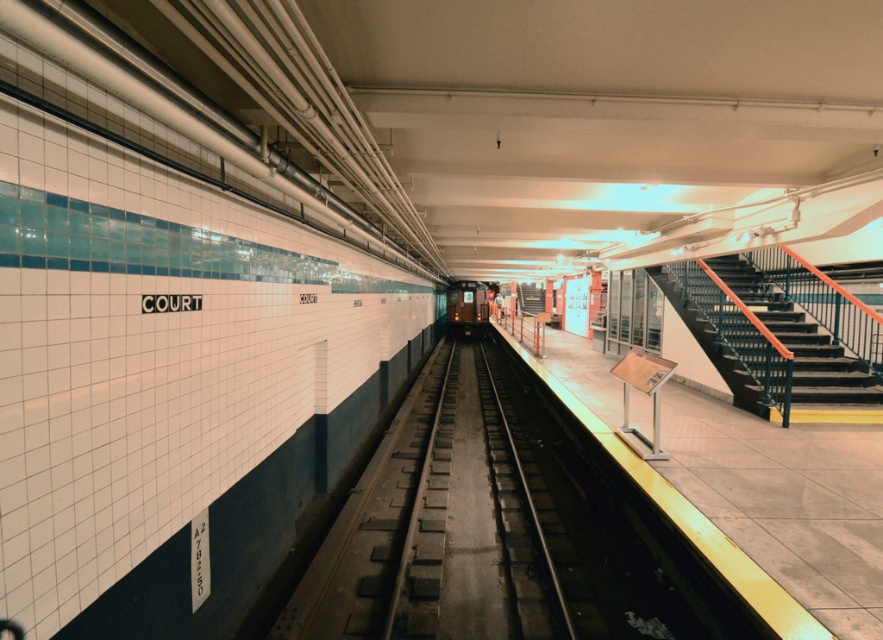
Question: Which point is closer to the camera taking this photo?

Choices:
 (A) (481, 298)
 (B) (737, 294)
 (C) (459, 362)

Answer: (B)

Question: Based on their relative distances, which object is farther from the black metal train track at center?

Choices:
 (A) metallic silver train at center
 (B) metallic black staircase at right

Answer: (A)

Question: Does metallic black staircase at right have a greater width compared to metallic silver train at center?

Choices:
 (A) no
 (B) yes

Answer: (A)

Question: Can you confirm if metallic black staircase at right is positioned to the right of metallic silver train at center?

Choices:
 (A) yes
 (B) no

Answer: (A)

Question: Which object appears farthest from the camera in this image?

Choices:
 (A) black metal train track at center
 (B) metallic black staircase at right
 (C) metallic silver train at center

Answer: (C)

Question: Is metallic black staircase at right below metallic silver train at center?

Choices:
 (A) yes
 (B) no

Answer: (A)